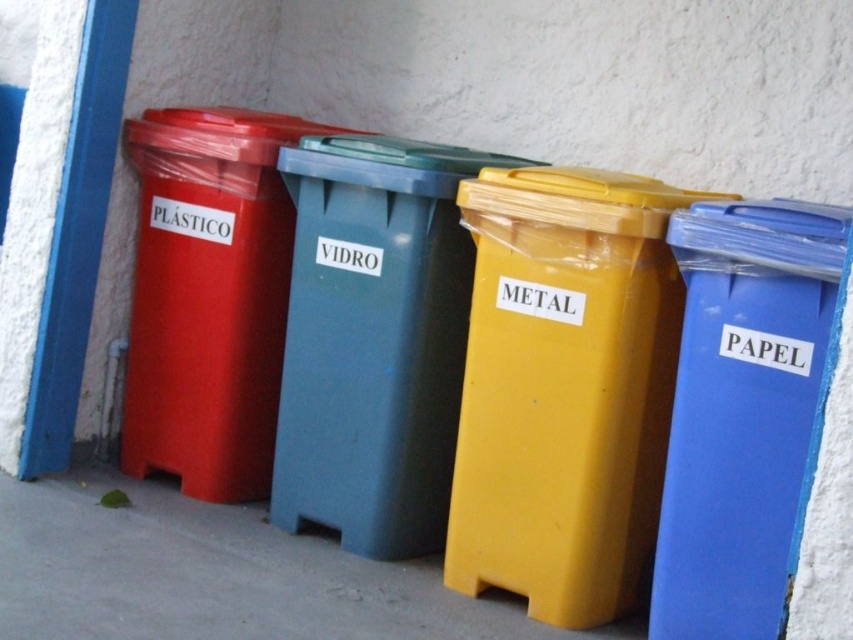
You are standing in front of the recycling bins and need to place a small item into the correct bin. The item is too heavy to lift, so you decide to roll it towards the bins. The item rolls straight ahead and stops exactly between the matte plastic trash can at left and the yellow matte plastic bin at lower center. Which bin is closer to you?

The matte plastic trash can at left is closer to you because it is above the yellow matte plastic bin at lower center, meaning it is positioned higher up and thus nearer in the arrangement.

You are standing in front of the recycling bins and need to place a piece of blue plastic paper. Which bin should you put it into, the blue plastic paper at right or the yellow matte plastic bin at lower center? Explain your reasoning based on their positions.

The blue plastic paper at right is located above the yellow matte plastic bin at lower center. Since the blue plastic paper at right is positioned higher up, it is likely the correct bin for paper materials. The yellow matte plastic bin at lower center is meant for metal, so you should place the blue plastic paper into the blue plastic paper at right.